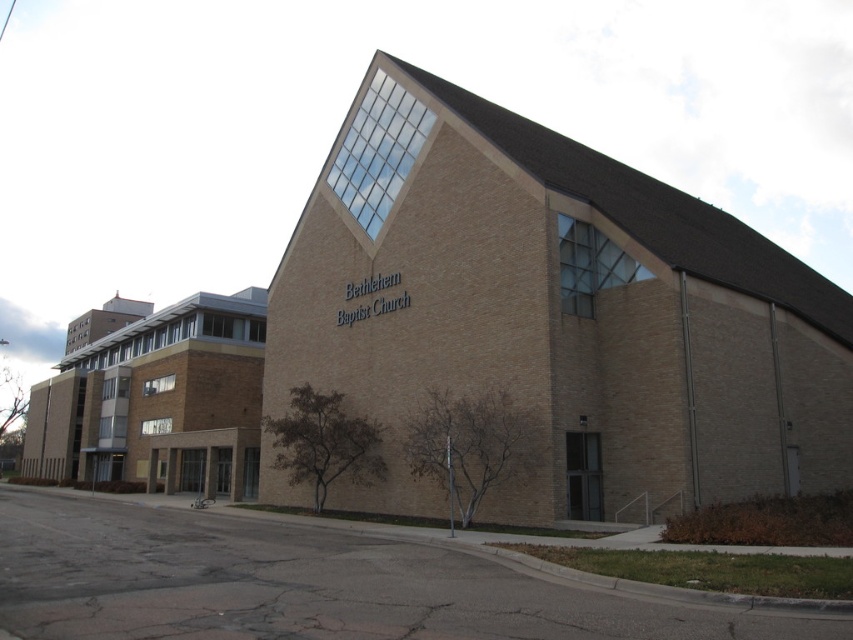
You are standing at the entrance of the brown brick church at center. If you face the church, where would you find the metal railing relative to the church?

The metal railing is near the entrance of the brown brick church at center, so it would be located in front of the church when facing it.

Consider the image. You are standing at the entrance of the Bethlehem Baptist Church and want to locate the exact spot where the point at coordinates point (554, 314) is marked. Based on the scene description, where would this point be located?

The point at coordinates point (554, 314) corresponds to the brown brick church at center, so it is located at the central area of the church building.

Looking at this image, you are a delivery person who needs to park your van in front of the brown brick church at center. The van is 7 meters long. There is a brown brick building at left nearby. Is there enough space between them to park the van without blocking the sidewalk?

The distance between the brown brick church at center and brown brick building at left is 27.89 meters. Since the van is only 7 meters long, there is sufficient space to park between them without blocking the sidewalk.